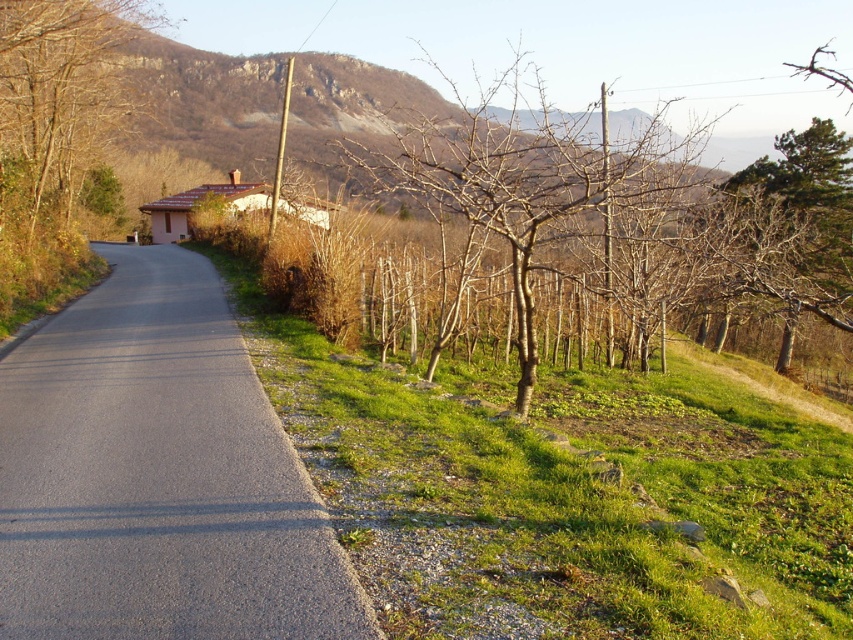
Which is behind, point (531, 326) or point (88, 8)?

Point (88, 8)

Does bare wood tree at center have a greater height compared to brown leafless tree at upper left?

Yes, bare wood tree at center is taller than brown leafless tree at upper left.

Between point (519, 410) and point (27, 38), which one is positioned in front?

Positioned in front is point (519, 410).

Where is `bare wood tree at center`? This screenshot has width=853, height=640. bare wood tree at center is located at coordinates coord(532,186).

Looking at this image, between gray asphalt road at center and bare wood tree at center, which one is positioned lower?

gray asphalt road at center

Does gray asphalt road at center lie in front of bare wood tree at center?

Yes, gray asphalt road at center is closer to the viewer.

Locate an element on the screen. gray asphalt road at center is located at coordinates (157, 476).

Does gray asphalt road at center have a lesser height compared to brown leafless tree at upper left?

Yes, gray asphalt road at center is shorter than brown leafless tree at upper left.

Does gray asphalt road at center have a greater width compared to brown leafless tree at upper left?

No.

Does point (142, 545) lie in front of point (26, 147)?

Yes, point (142, 545) is closer to viewer.

Image resolution: width=853 pixels, height=640 pixels. What are the coordinates of `gray asphalt road at center` in the screenshot? It's located at (157, 476).